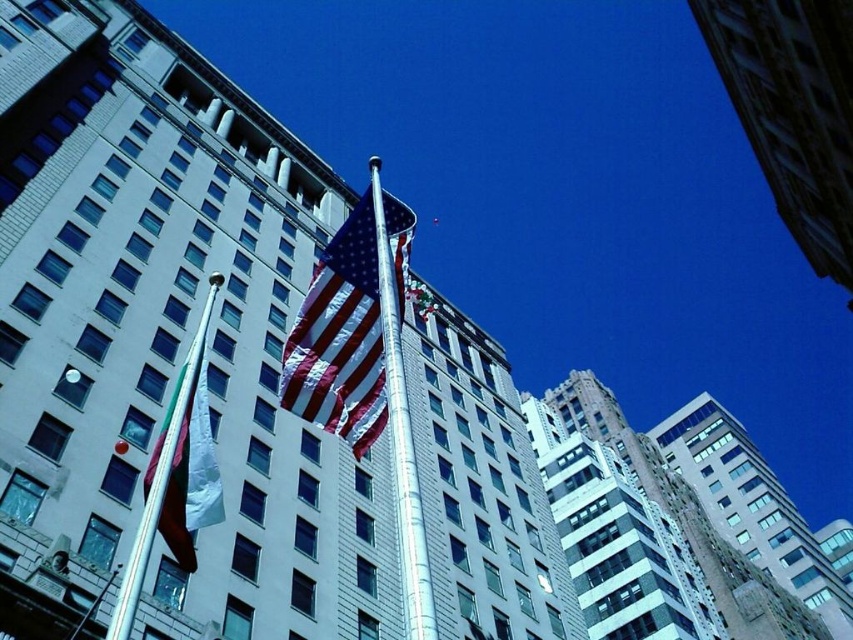
In the scene shown: Between silver metallic flag pole at upper center and polished silver pole at center, which one appears on the right side from the viewer's perspective?

polished silver pole at center is more to the right.

Who is more distant from viewer, [190,381] or [395,282]?

Point [395,282]

Image resolution: width=853 pixels, height=640 pixels. Find the location of `silver metallic flag pole at upper center`. silver metallic flag pole at upper center is located at coordinates (177, 477).

Is polished silver pole at center thinner than white fabric flag at left?

Yes, polished silver pole at center is thinner than white fabric flag at left.

Who is more distant from viewer, (393,460) or (177,388)?

The point (177,388) is more distant.

Who is more distant from viewer, [379,208] or [196,500]?

The point [379,208] is behind.

The image size is (853, 640). Identify the location of polished silver pole at center. [401, 433].

Between american flag at center and white fabric flag at left, which one is positioned higher?

Positioned higher is american flag at center.

In the scene shown: Which is more to the right, american flag at center or white fabric flag at left?

Positioned to the right is american flag at center.

The width and height of the screenshot is (853, 640). Find the location of `american flag at center`. american flag at center is located at coordinates (349, 324).